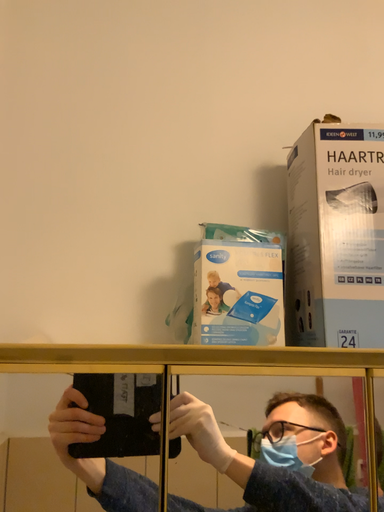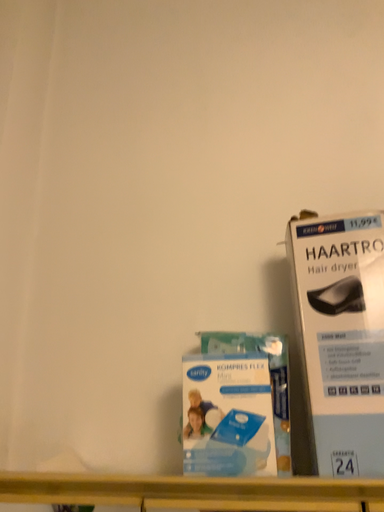
Question: Which way did the camera rotate in the video?

Choices:
 (A) rotated downward
 (B) rotated upward

Answer: (B)